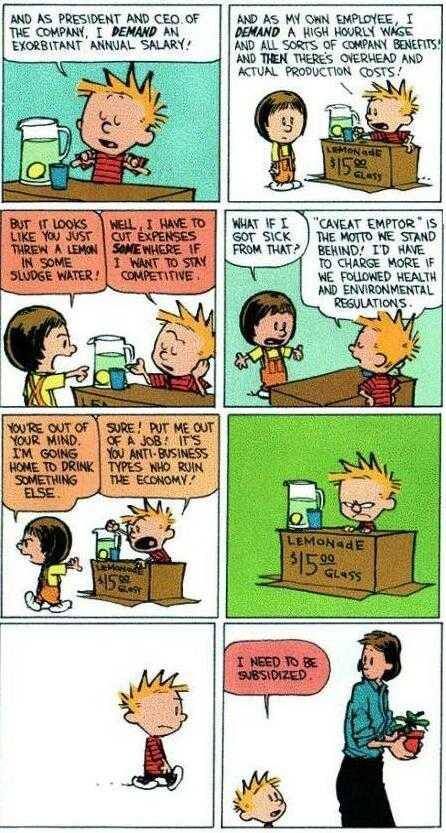
Image resolution: width=446 pixels, height=833 pixels. I want to click on inverted cardboard box, so click(x=163, y=188), click(x=371, y=172), click(x=335, y=375), click(x=158, y=396), click(x=158, y=591), click(x=372, y=570).